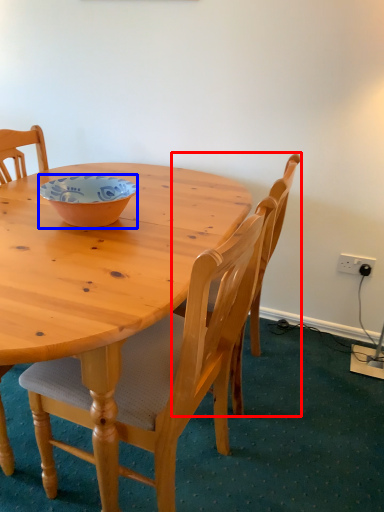
Question: Which object appears closest to the camera in this image, chair (highlighted by a red box) or bowl (highlighted by a blue box)?

Choices:
 (A) chair
 (B) bowl

Answer: (B)